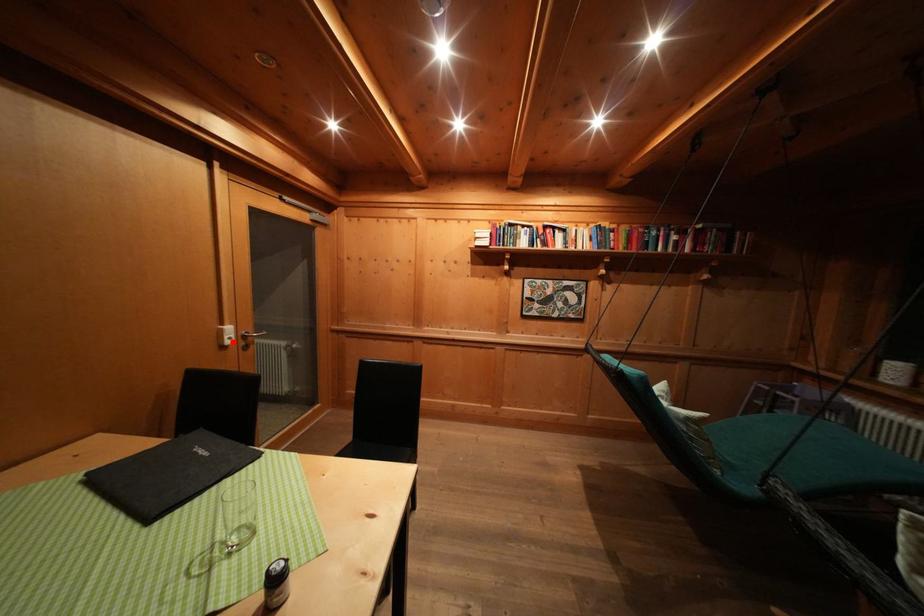
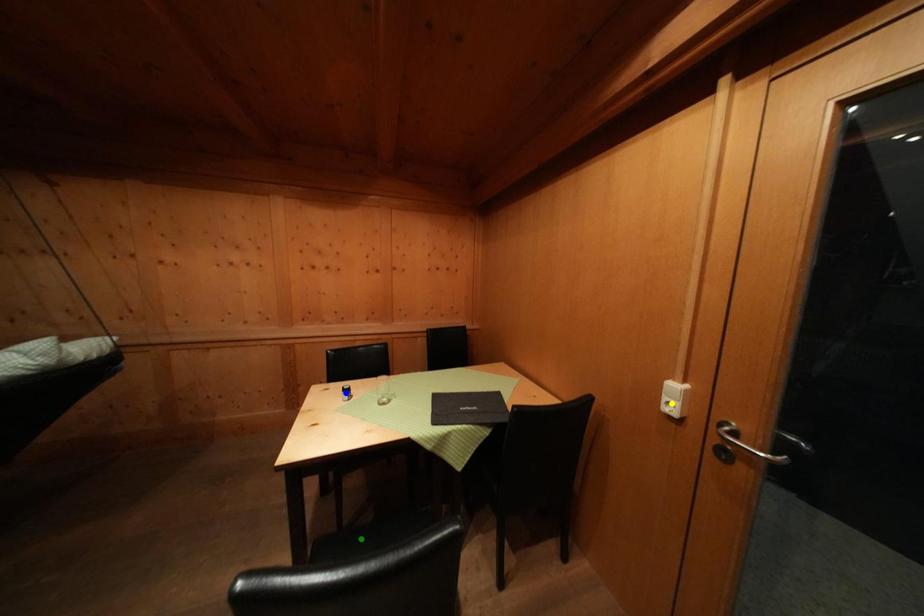
Question: I am providing you with two images of the same scene from different viewpoints. A red point is marked on the first image. You are given multiple points on the second image. In image 2, which mark is for the same physical point as the one in image 1?

Choices:
 (A) yellow point
 (B) green point
 (C) blue point

Answer: (A)